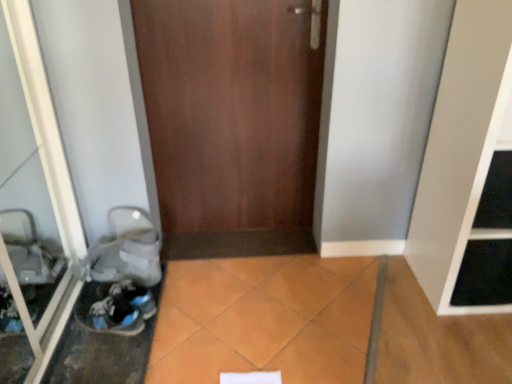
I want to click on free space in front of blue suede sneakers at lower left, so click(101, 358).